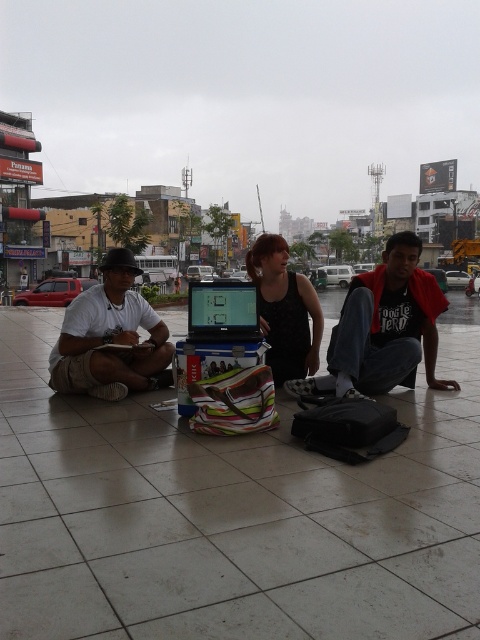
You are a photographer setting up a tripod to capture a group photo of the white matte shirt at center and the black matte tank top at center. Based on their heights, which person should you adjust the camera angle to focus on first to ensure both are in frame?

The white matte shirt at center has a lesser height compared to the black matte tank top at center, so you should focus on the taller black matte tank top at center first to ensure the camera angle accommodates both heights.

Based on the photo, you are a delivery person needing to place a small package between the dark red cotton shirt at lower right and the black plastic laptop at center. The package is 2 feet long. Can you fit it in the space between them?

The dark red cotton shirt at lower right is 3.97 feet from the black plastic laptop at center. Since the package is only 2 feet long, it can easily fit in the space between them.